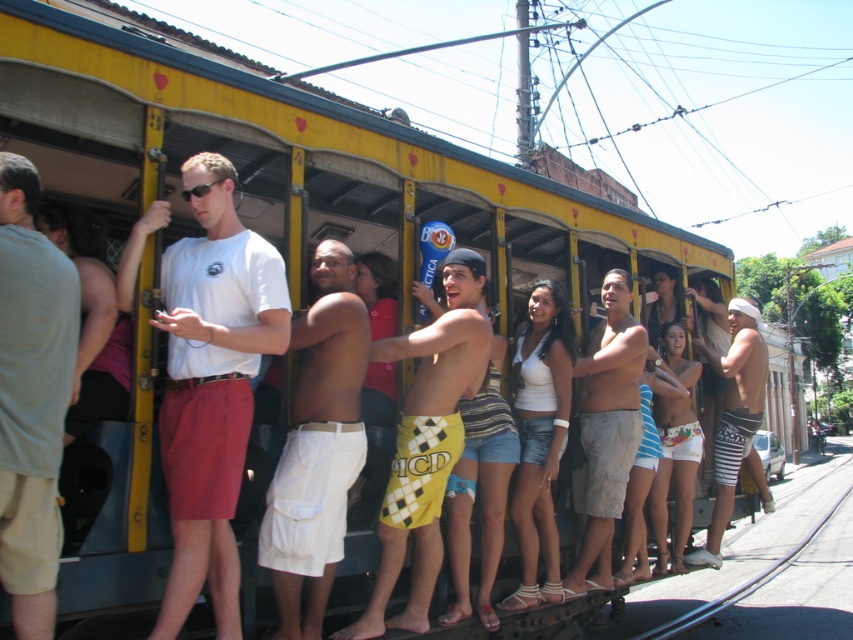
Question: Does light gray cotton t-shirt at left lie in front of yellow checkered shorts at center?

Choices:
 (A) yes
 (B) no

Answer: (A)

Question: Is white cotton t-shirt at center in front of light gray cotton t-shirt at left?

Choices:
 (A) yes
 (B) no

Answer: (B)

Question: Which object is closer to the camera taking this photo?

Choices:
 (A) white cotton t-shirt at center
 (B) light gray cotton t-shirt at left
 (C) tan cargo shorts at center
 (D) striped cotton shorts at right

Answer: (B)

Question: Is metallic gray train track at lower right behind striped cotton shorts at right?

Choices:
 (A) yes
 (B) no

Answer: (A)

Question: Based on their relative distances, which object is farther from the tan cargo shorts at center?

Choices:
 (A) light gray cotton t-shirt at left
 (B) metallic gray train track at lower right
 (C) striped cotton shorts at right

Answer: (B)

Question: Among these points, which one is farthest from the camera?

Choices:
 (A) (743, 440)
 (B) (431, 541)
 (C) (161, 211)
 (D) (602, 406)

Answer: (A)